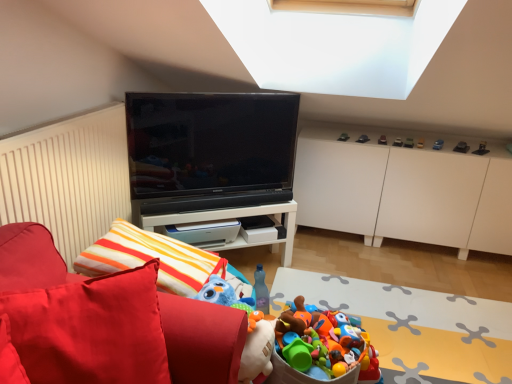
Question: From a real-world perspective, is metallic red car at upper right, arranged as the 6th toy when viewed from the right, below metallic car at upper right, the fifth toy viewed from the right?

Choices:
 (A) yes
 (B) no

Answer: (A)

Question: Is metallic red car at upper right, placed as the sixth toy when sorted from left to right, shorter than metallic car at upper right, which is counted as the 7th toy, starting from the left?

Choices:
 (A) no
 (B) yes

Answer: (B)

Question: Is metallic red car at upper right, placed as the sixth toy when sorted from left to right, far away from metallic car at upper right, the seventh toy in the bottom-to-top sequence?

Choices:
 (A) no
 (B) yes

Answer: (A)

Question: Considering the relative sizes of metallic red car at upper right, placed as the sixth toy when sorted from left to right, and metallic car at upper right, which is counted as the 7th toy, starting from the left, in the image provided, is metallic red car at upper right, placed as the sixth toy when sorted from left to right, bigger than metallic car at upper right, which is counted as the 7th toy, starting from the left,?

Choices:
 (A) no
 (B) yes

Answer: (A)

Question: From the image's perspective, is metallic red car at upper right, placed as the sixth toy when sorted from left to right, over metallic car at upper right, positioned as the fifth toy in top-to-bottom order?

Choices:
 (A) no
 (B) yes

Answer: (B)

Question: Is metallic red car at upper right, positioned as the 4th toy in top-to-bottom order, inside the boundaries of metallic silver toy car at upper right, acting as the 3th toy starting from the left, or outside?

Choices:
 (A) inside
 (B) outside

Answer: (B)

Question: Visually, is metallic red car at upper right, arranged as the 6th toy when viewed from the right, positioned to the left or to the right of metallic silver toy car at upper right, acting as the 3th toy starting from the left?

Choices:
 (A) right
 (B) left

Answer: (A)

Question: In the image, is metallic red car at upper right, arranged as the 6th toy when viewed from the right, positioned in front of or behind metallic silver toy car at upper right, acting as the 3th toy starting from the left?

Choices:
 (A) front
 (B) behind

Answer: (A)

Question: From the image's perspective, is metallic red car at upper right, arranged as the 6th toy when viewed from the right, above or below metallic silver toy car at upper right, which appears as the 1th toy when viewed from the top?

Choices:
 (A) below
 (B) above

Answer: (A)

Question: Is velvet red sofa at left spatially inside metallic black toy car at upper right, marked as the 9th toy in a top-to-bottom arrangement, or outside of it?

Choices:
 (A) outside
 (B) inside

Answer: (A)

Question: From the image's perspective, is velvet red sofa at left positioned above or below metallic black toy car at upper right, which is the first toy in right-to-left order?

Choices:
 (A) below
 (B) above

Answer: (A)

Question: Relative to metallic black toy car at upper right, the 3th toy ordered from the bottom, is velvet red sofa at left in front or behind?

Choices:
 (A) front
 (B) behind

Answer: (A)

Question: From a real-world perspective, is velvet red sofa at left physically located above or below metallic black toy car at upper right, marked as the 9th toy in a top-to-bottom arrangement?

Choices:
 (A) above
 (B) below

Answer: (B)

Question: Would you say metallic silver toy car at upper right, the eleventh toy when ordered from bottom to top, is to the left or to the right of metallic silver toy car at upper right, which appears as the ninth toy when ordered from the bottom, in the picture?

Choices:
 (A) left
 (B) right

Answer: (A)

Question: Considering the positions of metallic silver toy car at upper right, which is counted as the ninth toy, starting from the right, and metallic silver toy car at upper right, which ranks as the 5th toy in left-to-right order, in the image, is metallic silver toy car at upper right, which is counted as the ninth toy, starting from the right, taller or shorter than metallic silver toy car at upper right, which ranks as the 5th toy in left-to-right order,?

Choices:
 (A) short
 (B) tall

Answer: (A)